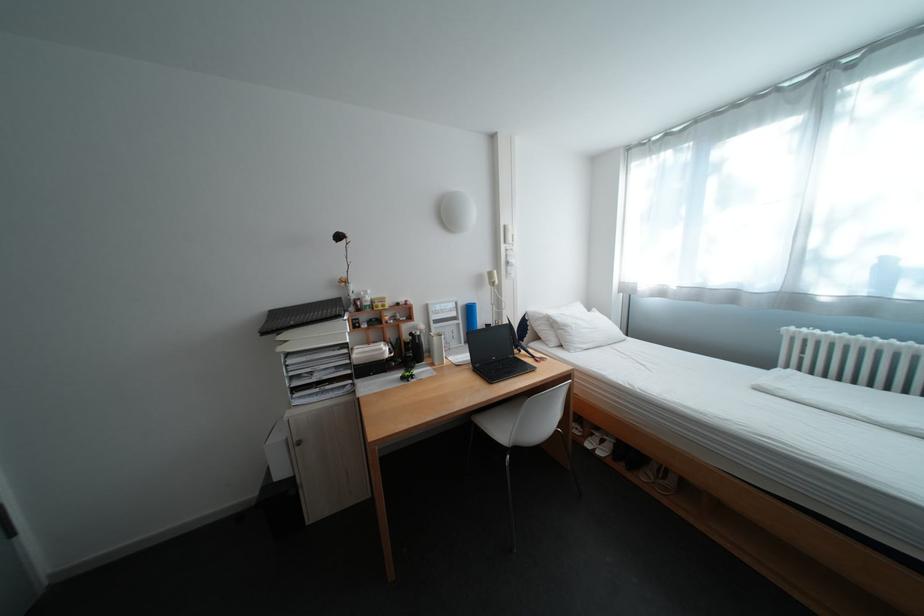
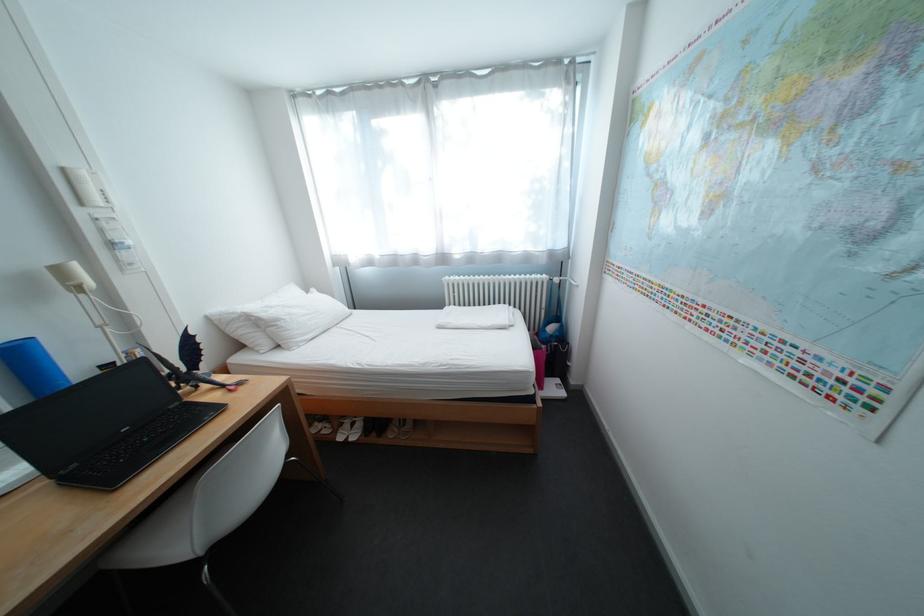
Locate, in the second image, the point that corresponds to pixel 602 439 in the first image.

(353, 431)